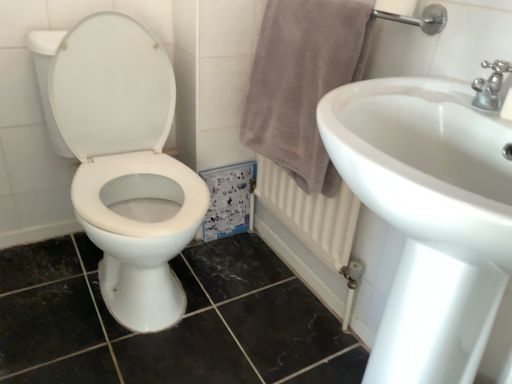
Question: Is point (330, 23) closer or farther from the camera than point (495, 74)?

Choices:
 (A) closer
 (B) farther

Answer: (B)

Question: From the image's perspective, is light gray plush towel at right located above or below silver metallic faucet at upper right?

Choices:
 (A) below
 (B) above

Answer: (B)

Question: Which of these objects is positioned closest to the white glossy toilet at left?

Choices:
 (A) light gray plush towel at right
 (B) silver metallic faucet at upper right
 (C) white glossy sink at upper right

Answer: (A)

Question: Estimate the real-world distances between objects in this image. Which object is farther from the white glossy toilet at left?

Choices:
 (A) silver metallic faucet at upper right
 (B) white glossy sink at upper right
 (C) light gray plush towel at right

Answer: (A)